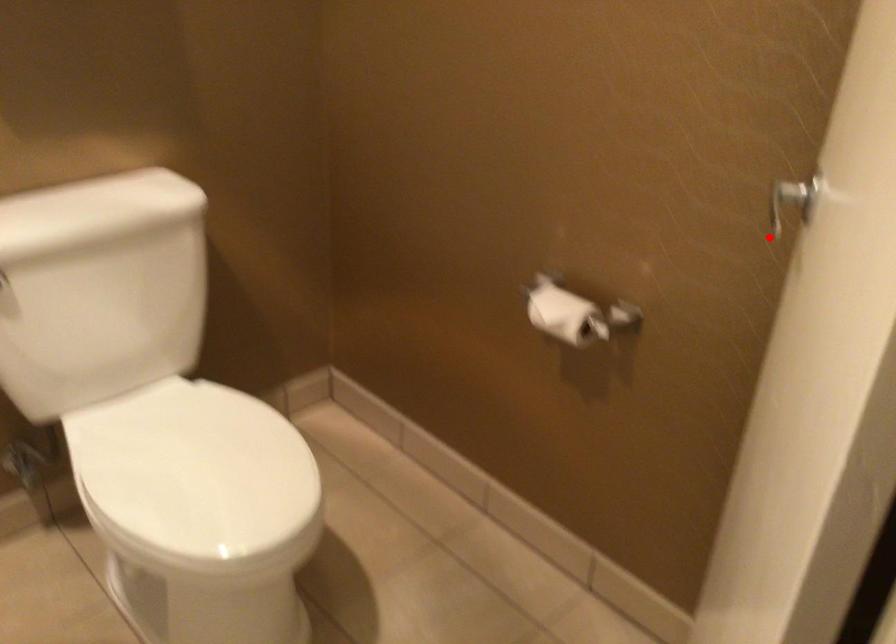
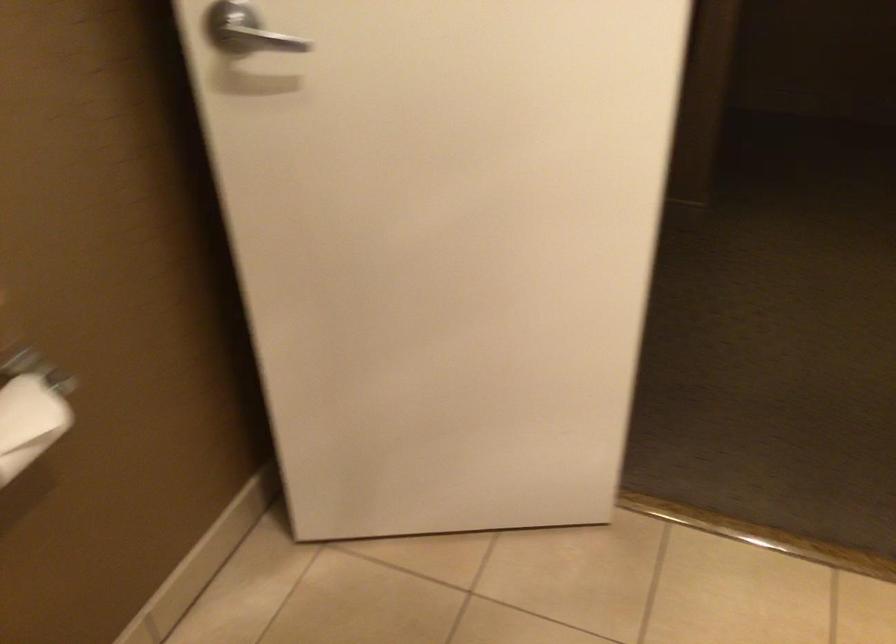
In the second image, find the point that corresponds to the highlighted location in the first image.

(257, 39)